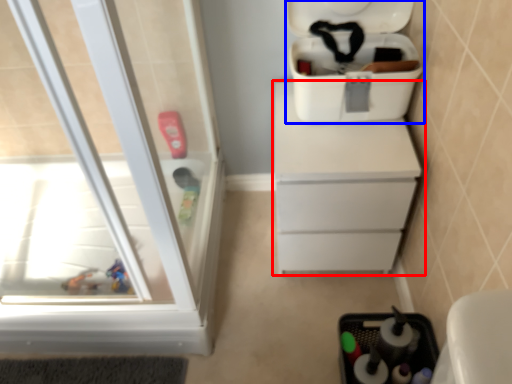
Question: Which object is closer to the camera taking this photo, chest of drawers (highlighted by a red box) or cooler (highlighted by a blue box)?

Choices:
 (A) chest of drawers
 (B) cooler

Answer: (B)